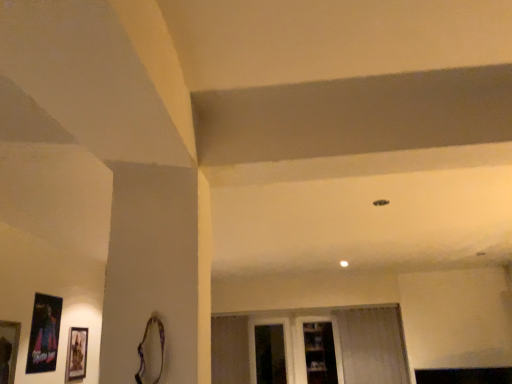
Question: Considering the positions of matte black picture frame at lower left, the 1th picture frame in the back-to-front sequence, and metallic poster at left, marked as the second picture frame in a back-to-front arrangement, in the image, is matte black picture frame at lower left, the 1th picture frame in the back-to-front sequence, wider or thinner than metallic poster at left, marked as the second picture frame in a back-to-front arrangement,?

Choices:
 (A) thin
 (B) wide

Answer: (B)

Question: Relative to metallic poster at left, marked as the second picture frame in a back-to-front arrangement, is matte black picture frame at lower left, which is the third picture frame in front-to-back order, in front or behind?

Choices:
 (A) behind
 (B) front

Answer: (A)

Question: Which is farther from the metallic poster at left, marked as the second picture frame in a back-to-front arrangement?

Choices:
 (A) matte black picture frame at lower left, the 1th picture frame in the back-to-front sequence
 (B) clear glass shelves at center
 (C) transparent glass window at center
 (D) transparent glass door at center
 (E) wooden picture frame at lower left, the third picture frame in the back-to-front sequence

Answer: (B)

Question: Estimate the real-world distances between objects in this image. Which object is closer to the clear glass shelves at center?

Choices:
 (A) white sheer curtain at lower right
 (B) matte black picture frame at lower left, which is the third picture frame in front-to-back order
 (C) wooden picture frame at lower left, the third picture frame in the back-to-front sequence
 (D) transparent glass window at center
 (E) transparent glass door at center

Answer: (E)